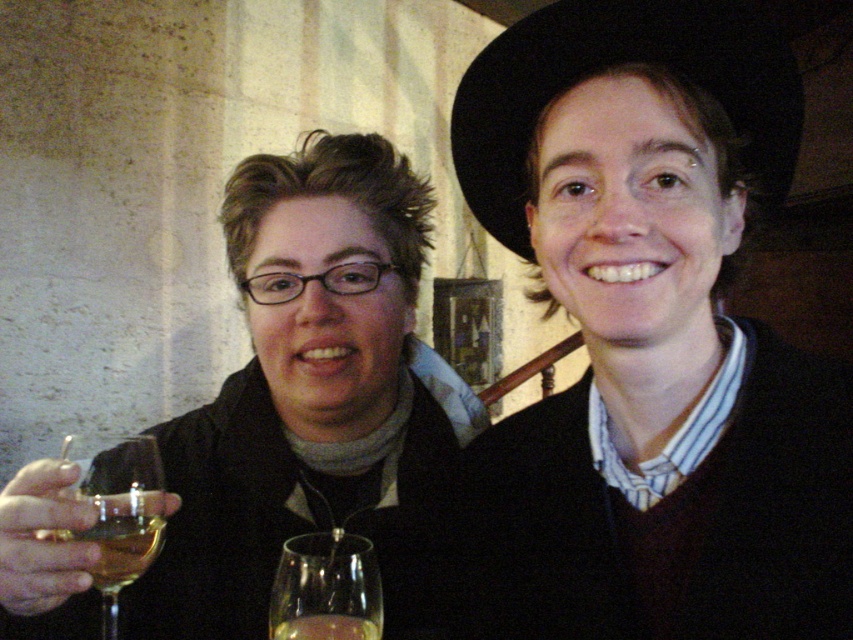
Question: Observing the image, what is the correct spatial positioning of clear glass wine glass at lower left in reference to translucent glass at center?

Choices:
 (A) below
 (B) above

Answer: (B)

Question: Does clear glass wine glass at lower left have a lesser width compared to translucent glass at center?

Choices:
 (A) no
 (B) yes

Answer: (A)

Question: Among these objects, which one is nearest to the camera?

Choices:
 (A) matte black jacket at left
 (B) translucent glass wine at center
 (C) clear glass wine glass at lower left

Answer: (A)

Question: Does translucent glass at center appear on the left side of translucent glass wine at center?

Choices:
 (A) yes
 (B) no

Answer: (A)

Question: Based on their relative distances, which object is nearer to the translucent glass at center?

Choices:
 (A) translucent glass wine at center
 (B) clear glass wine glass at lower left
 (C) matte black jacket at left

Answer: (A)

Question: Which object appears farthest from the camera in this image?

Choices:
 (A) translucent glass wine at center
 (B) translucent glass at center
 (C) matte black jacket at left

Answer: (A)